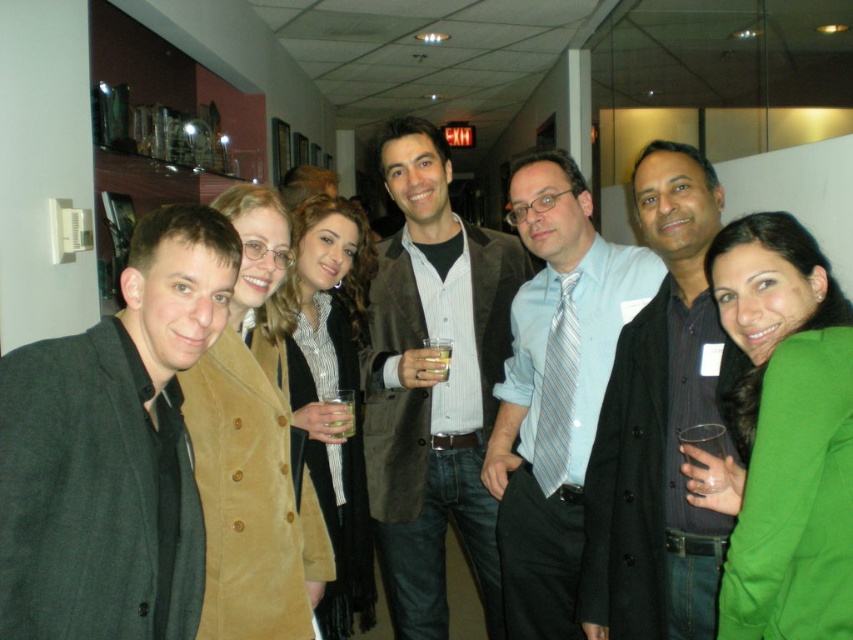
Question: Which object is closer to the camera taking this photo?

Choices:
 (A) green matte blazer at center
 (B) dark gray wool jacket at left
 (C) brown suede coat at center

Answer: (B)

Question: Which point appears farthest from the camera in this image?

Choices:
 (A) (840, 628)
 (B) (426, 609)

Answer: (B)

Question: Can you confirm if brown textured blazer at center is positioned below light blue shirt with tie at center?

Choices:
 (A) yes
 (B) no

Answer: (A)

Question: Does dark gray wool jacket at left appear over light blue shirt with tie at center?

Choices:
 (A) yes
 (B) no

Answer: (A)

Question: Which of the following is the farthest from the observer?

Choices:
 (A) (323, 464)
 (B) (850, 506)
 (C) (520, 435)
 (D) (274, 563)

Answer: (C)

Question: Is dark gray wool jacket at left wider than translucent glass at center?

Choices:
 (A) yes
 (B) no

Answer: (A)